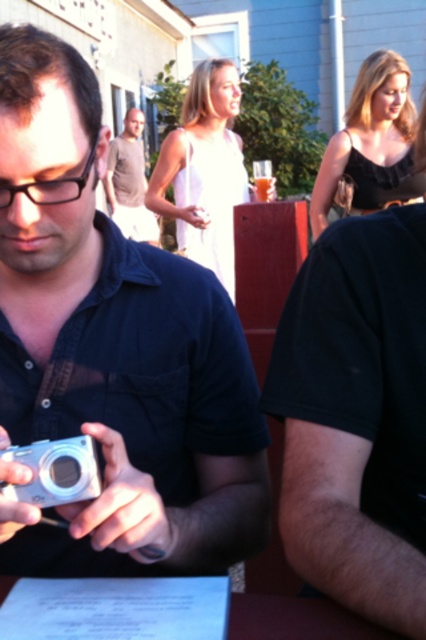
Question: Where is silver metallic camera at lower left located in relation to light brown shirt at center in the image?

Choices:
 (A) left
 (B) right

Answer: (B)

Question: Is silver metallic camera at lower left below light brown shirt at center?

Choices:
 (A) no
 (B) yes

Answer: (B)

Question: Does silver metallic camera at left appear on the left side of light brown shirt at center?

Choices:
 (A) no
 (B) yes

Answer: (A)

Question: Among these points, which one is nearest to the camera?

Choices:
 (A) (241, 336)
 (B) (132, 176)
 (C) (34, 464)

Answer: (C)

Question: Estimate the real-world distances between objects in this image. Which object is closer to the white paper at lower center?

Choices:
 (A) silver metallic camera at lower left
 (B) light brown shirt at center
 (C) silver metallic camera at left

Answer: (A)

Question: Which object is closer to the camera taking this photo?

Choices:
 (A) light brown shirt at center
 (B) silver metallic camera at left
 (C) white paper at lower center

Answer: (B)